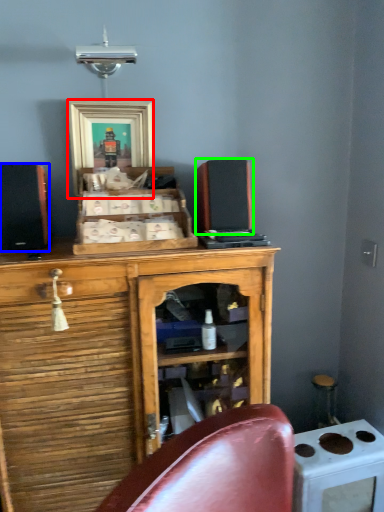
Question: Which object is the farthest from picture frame (highlighted by a red box)? Choose among these: speaker (highlighted by a blue box) or speaker (highlighted by a green box).

Choices:
 (A) speaker
 (B) speaker

Answer: (B)